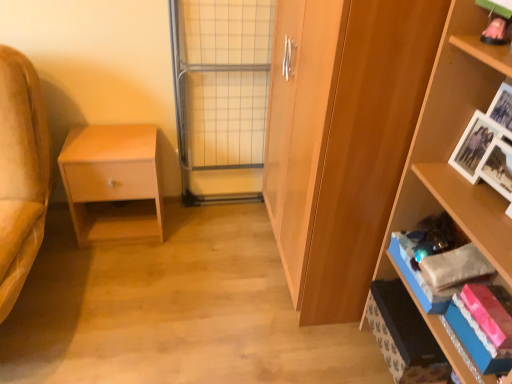
Where is `free point below metal grid screen door at center (from a real-world perspective)`? free point below metal grid screen door at center (from a real-world perspective) is located at coordinates (223, 206).